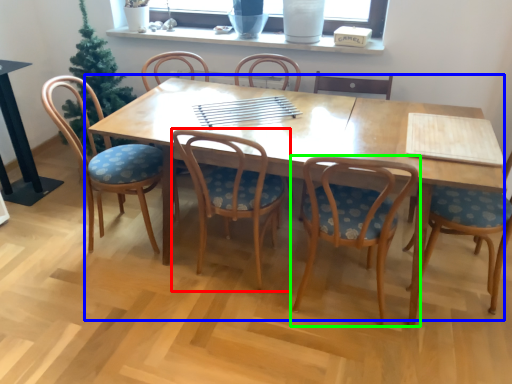
Question: Considering the real-world distances, which object is closest to chair (highlighted by a red box)? kitchen & dining room table (highlighted by a blue box) or chair (highlighted by a green box).

Choices:
 (A) kitchen & dining room table
 (B) chair

Answer: (A)